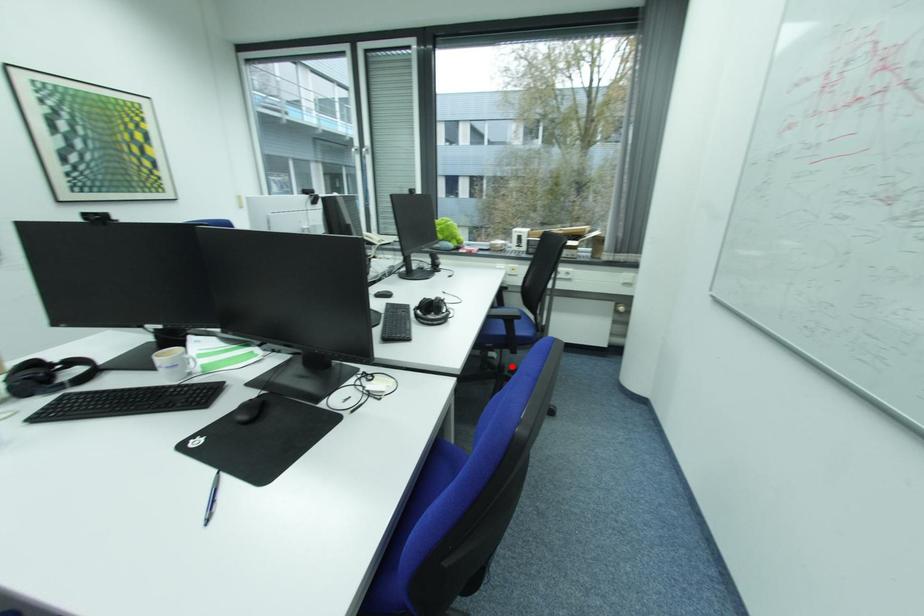
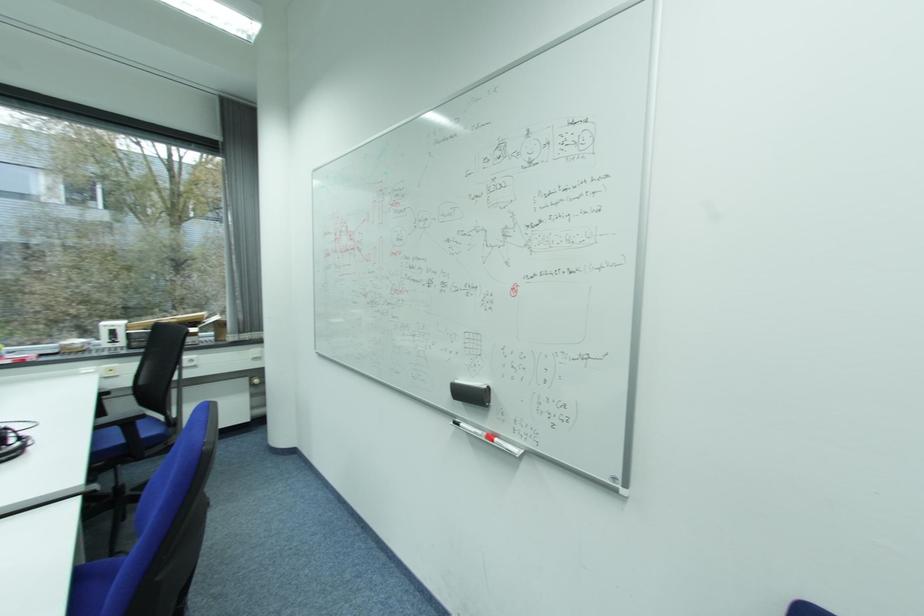
Question: A red point is marked in image1. In image2, is the corresponding 3D point closer to the camera or farther? Reply with the corresponding letter.

Choices:
 (A) The corresponding 3D point is closer.
 (B) The corresponding 3D point is farther.

Answer: (B)